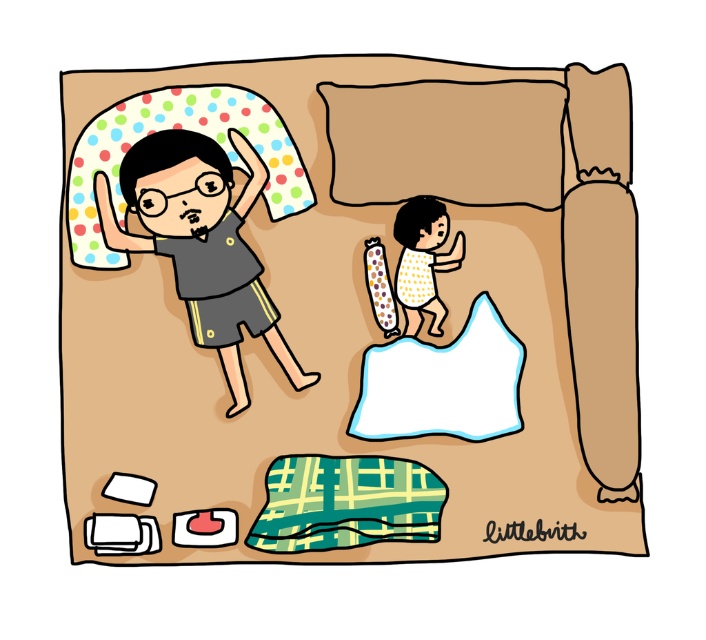
Does white fabric pillow at upper center appear under yellow dotted shirt at upper center?

Yes, white fabric pillow at upper center is below yellow dotted shirt at upper center.

Which is in front, point (493, 362) or point (424, 225)?

Point (424, 225) is in front.

Which is in front, point (496, 346) or point (431, 284)?

Positioned in front is point (496, 346).

Identify the location of white fabric pillow at upper center. The width and height of the screenshot is (706, 640). (443, 384).

Is polka dot pillow at upper left smaller than yellow dotted shirt at upper center?

Incorrect, polka dot pillow at upper left is not smaller in size than yellow dotted shirt at upper center.

Which is more to the left, polka dot pillow at upper left or yellow dotted shirt at upper center?

polka dot pillow at upper left is more to the left.

Between point (335, 360) and point (406, 221), which one is positioned behind?

Positioned behind is point (335, 360).

Locate an element on the screen. The width and height of the screenshot is (706, 640). polka dot pillow at upper left is located at coordinates (347, 314).

Can you confirm if polka dot pillow at upper left is positioned to the left of white fabric pillow at upper center?

Indeed, polka dot pillow at upper left is positioned on the left side of white fabric pillow at upper center.

Is polka dot pillow at upper left below white fabric pillow at upper center?

No, polka dot pillow at upper left is not below white fabric pillow at upper center.

At what (x,y) coordinates should I click in order to perform the action: click on polka dot pillow at upper left. Please return your answer as a coordinate pair (x, y). Image resolution: width=706 pixels, height=640 pixels. Looking at the image, I should click on (347, 314).